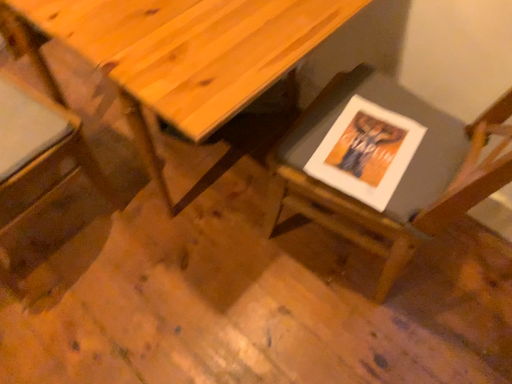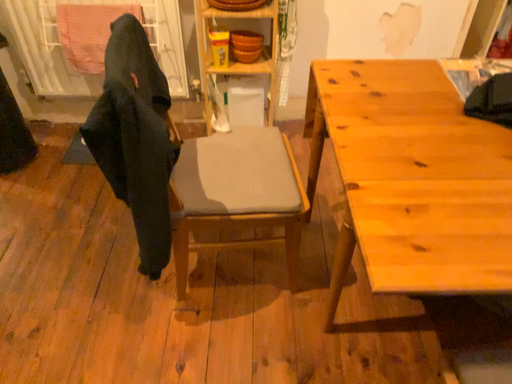
Question: How did the camera likely rotate when shooting the video?

Choices:
 (A) rotated downward
 (B) rotated upward

Answer: (B)